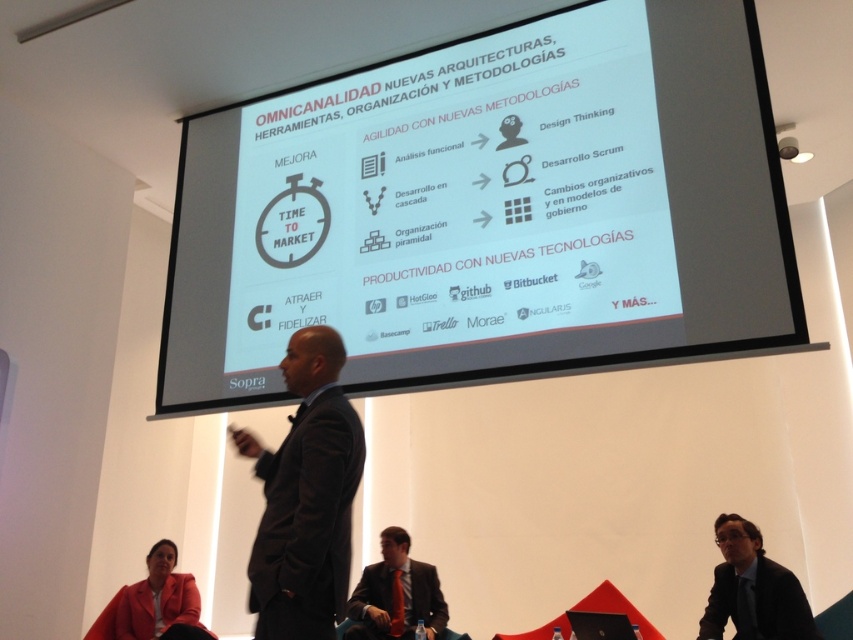
You are an attendee at the presentation and want to focus on the two points marked on the screen. Which of the two points, point [740,628] or point [415,566], is closer to you?

Point [740,628] is closer to the viewer than point [415,566].

You are an attendee at the presentation and need to choose between two black suits to present on stage. The black fabric business suit at lower right and the matte black suit at lower center. Which one is taller?

The black fabric business suit at lower right is taller than the matte black suit at lower center.

Imagine you are standing in the room where the presentation is happening. You need to place a small plant on the floor in the exact spot where the black fabric business suit at lower right is currently located. Where should you place the plant?

You should place the plant at the 2D coordinates point (x=780, y=604), which is where the black fabric business suit at lower right is located.